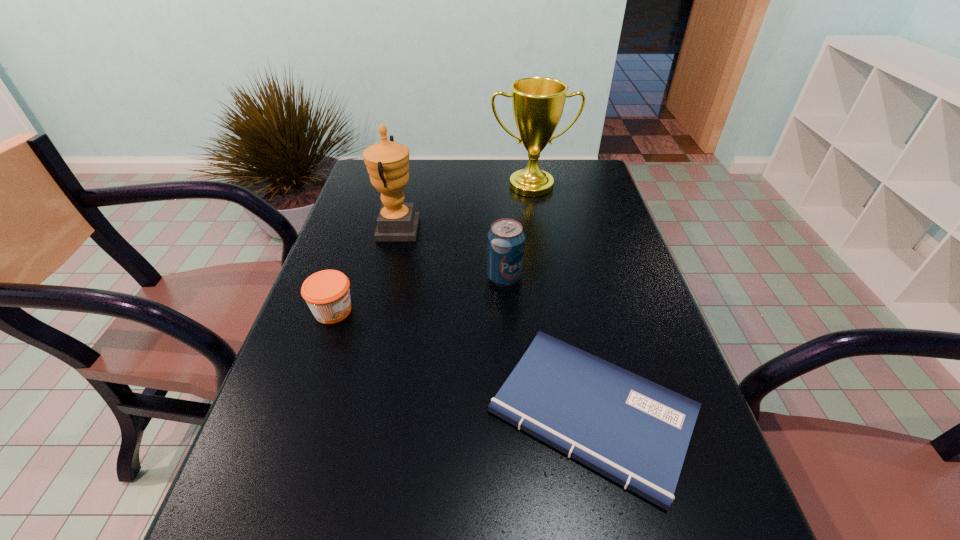
You are a GUI agent. You are given a task and a screenshot of the screen. Output one action in this format:
    pyautogui.click(x=<x>, y=<y>)
    Task: Click on the vacant area in the image that satisfies the following two spatial constraints: 1. by the handles of the farthest object; 2. at the front of the left award with handles
    The height and width of the screenshot is (540, 960).
    Given the screenshot: What is the action you would take?
    pyautogui.click(x=539, y=230)

Locate an element on the screen. The image size is (960, 540). vacant space that satisfies the following two spatial constraints: 1. at the front of the pop soda with handles; 2. on the left side of the left award is located at coordinates (386, 277).